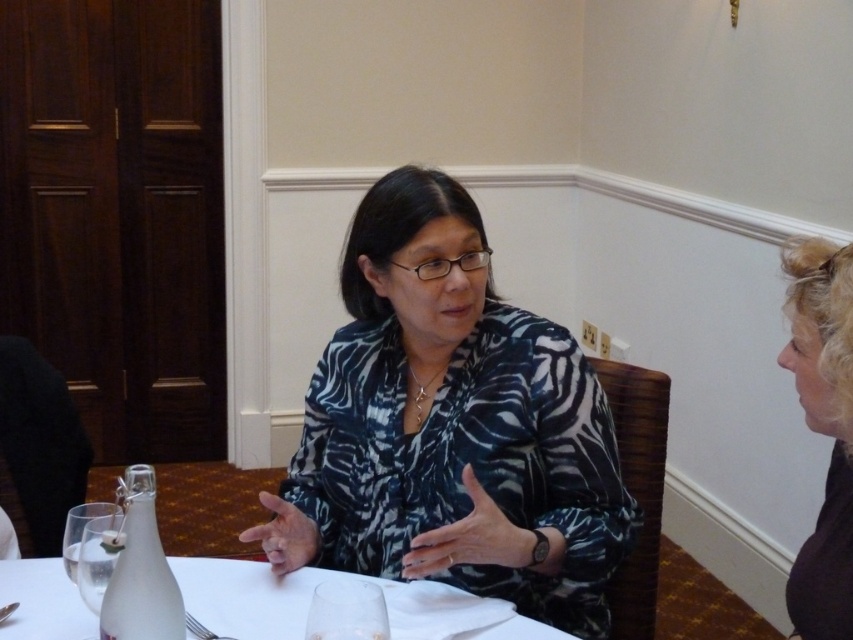
You are standing at the dining table and want to reach the two points marked on the table. Which point, point [357,552] or point [225,611], is closer to you?

Point [225,611] is closer to you because it is in front of point [357,552].

You are a guest at a formal dinner and see the white frosted glass at center and the clear glass at center on the table. Which glass is positioned to the left?

A: The white frosted glass at center is positioned to the left of the clear glass at center.